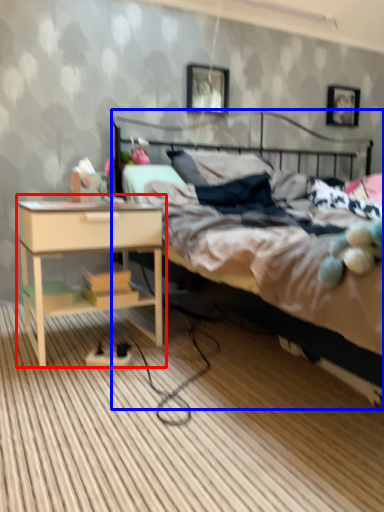
Question: Which object is further to the camera taking this photo, nightstand (highlighted by a red box) or bed (highlighted by a blue box)?

Choices:
 (A) nightstand
 (B) bed

Answer: (A)